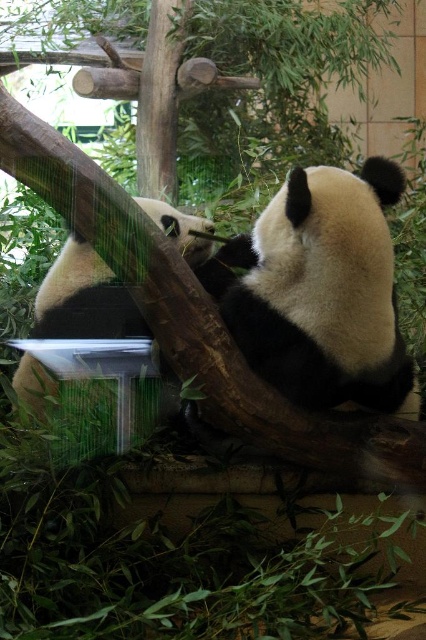
You are a zookeeper observing two pandas in their enclosure. You see the black matte panda at center and the black and white fur panda at center. Which panda is closer to you?

The black matte panda at center is closer to you because it is positioned further to the viewer than the black and white fur panda at center.